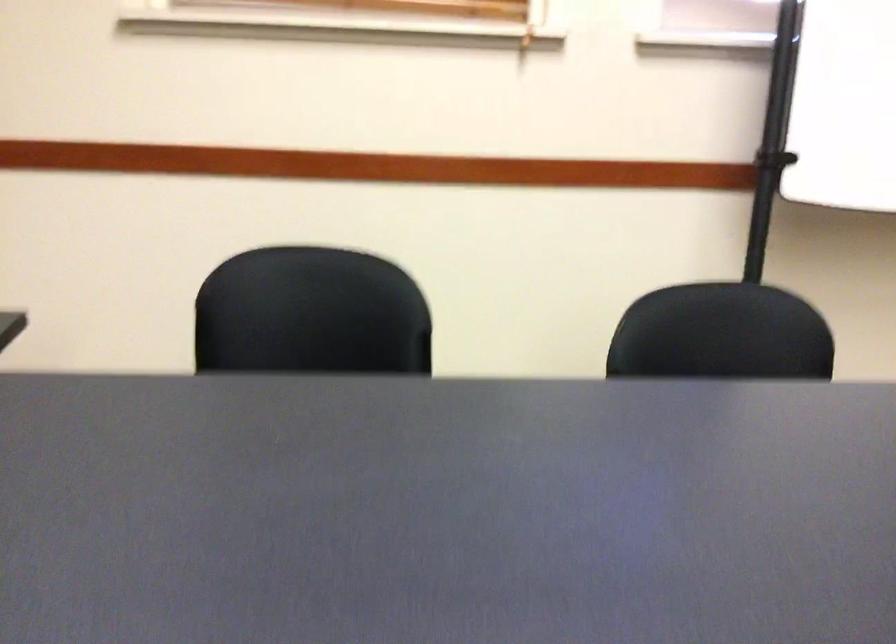
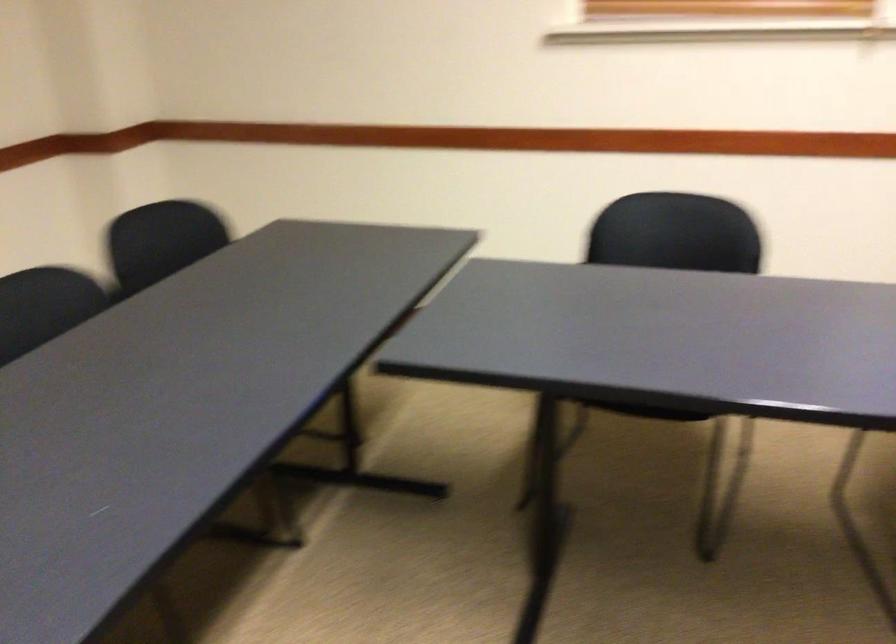
Find the pixel in the second image that matches (x=303, y=283) in the first image.

(672, 223)